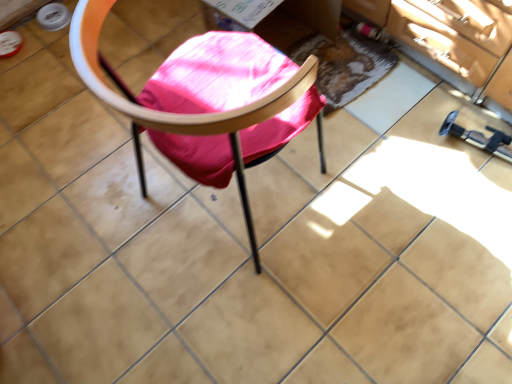
The width and height of the screenshot is (512, 384). I want to click on vacant area that lies to the right of textured woolen mat at center, so click(428, 90).